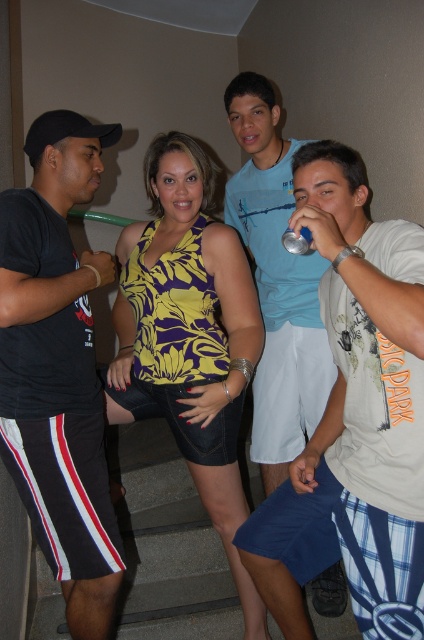
Does black cotton t-shirt at left have a lesser height compared to yellow floral tank top at center?

Indeed, black cotton t-shirt at left has a lesser height compared to yellow floral tank top at center.

How much distance is there between black cotton t-shirt at left and yellow floral tank top at center?

black cotton t-shirt at left and yellow floral tank top at center are 11.92 inches apart.

Between point (100, 508) and point (200, 209), which one is positioned behind?

The point (200, 209) is more distant.

Locate an element on the screen. black cotton t-shirt at left is located at coordinates (58, 368).

Where is `white cotton shirt at right`? This screenshot has width=424, height=640. white cotton shirt at right is located at coordinates (354, 417).

Can you confirm if white cotton shirt at right is wider than yellow floral tank top at center?

In fact, white cotton shirt at right might be narrower than yellow floral tank top at center.

You are a GUI agent. You are given a task and a screenshot of the screen. Output one action in this format:
    pyautogui.click(x=<x>, y=<y>)
    Task: Click on the white cotton shirt at right
    This screenshot has width=424, height=640.
    Given the screenshot: What is the action you would take?
    pyautogui.click(x=354, y=417)

Does black cotton t-shirt at left lie behind light blue cotton shirt at center?

That is False.

Who is positioned more to the right, black cotton t-shirt at left or light blue cotton shirt at center?

light blue cotton shirt at center

Find the location of `black cotton t-shirt at left`. black cotton t-shirt at left is located at coordinates (58, 368).